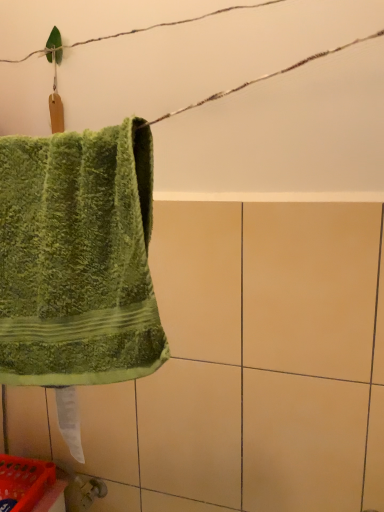
Question: In terms of height, does green fuzzy towel at left look taller or shorter compared to orange plastic basket at lower left?

Choices:
 (A) short
 (B) tall

Answer: (B)

Question: In the image, is green fuzzy towel at left positioned in front of or behind orange plastic basket at lower left?

Choices:
 (A) behind
 (B) front

Answer: (B)

Question: From a real-world perspective, is green fuzzy towel at left above or below orange plastic basket at lower left?

Choices:
 (A) above
 (B) below

Answer: (A)

Question: Considering the positions of point (29, 503) and point (97, 336), is point (29, 503) closer or farther from the camera than point (97, 336)?

Choices:
 (A) farther
 (B) closer

Answer: (A)

Question: Choose the correct answer: Is orange plastic basket at lower left inside green fuzzy towel at left or outside it?

Choices:
 (A) outside
 (B) inside

Answer: (A)

Question: In the image, is orange plastic basket at lower left positioned in front of or behind green fuzzy towel at left?

Choices:
 (A) behind
 (B) front

Answer: (A)

Question: In terms of width, does orange plastic basket at lower left look wider or thinner when compared to green fuzzy towel at left?

Choices:
 (A) thin
 (B) wide

Answer: (B)